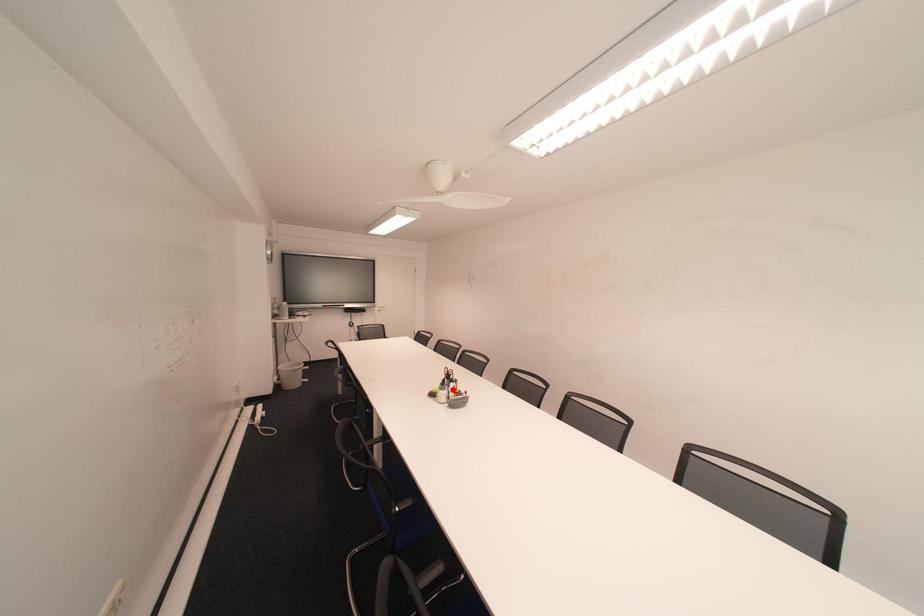
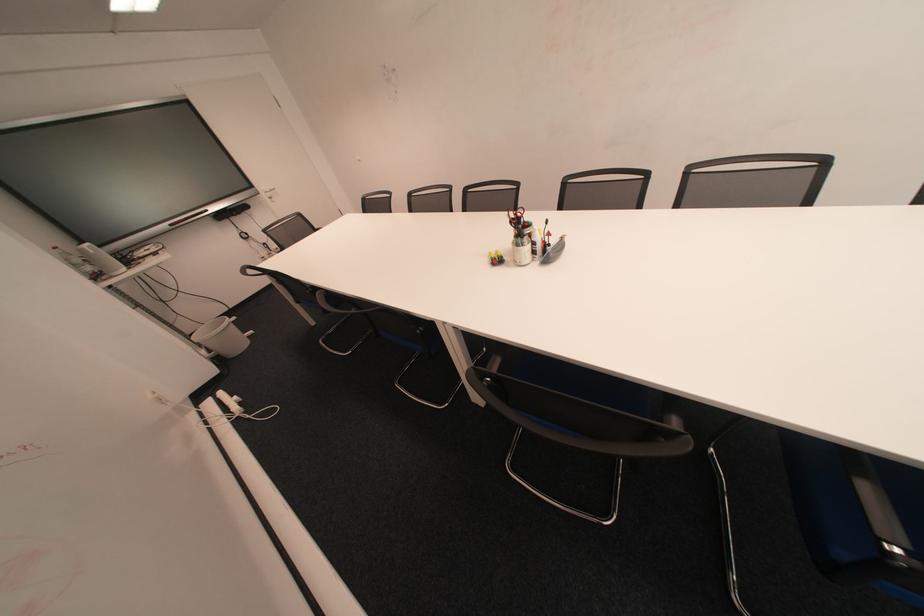
The point at the highlighted location is marked in the first image. Where is the corresponding point in the second image?

(529, 245)